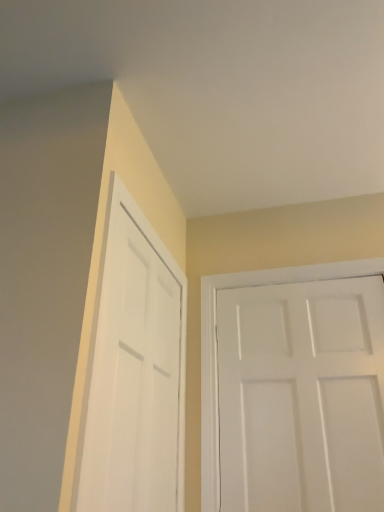
Question: Is point (145, 247) positioned closer to the camera than point (304, 358)?

Choices:
 (A) farther
 (B) closer

Answer: (B)

Question: Considering the positions of white matte door at left, marked as the 1th door in a left-to-right arrangement, and white matte door at right, which is counted as the 2th door, starting from the left, in the image, is white matte door at left, marked as the 1th door in a left-to-right arrangement, taller or shorter than white matte door at right, which is counted as the 2th door, starting from the left,?

Choices:
 (A) short
 (B) tall

Answer: (B)

Question: Considering the positions of white matte door at left, marked as the 1th door in a left-to-right arrangement, and white matte door at right, which is counted as the 2th door, starting from the left, in the image, is white matte door at left, marked as the 1th door in a left-to-right arrangement, wider or thinner than white matte door at right, which is counted as the 2th door, starting from the left,?

Choices:
 (A) wide
 (B) thin

Answer: (B)

Question: Relative to white matte door at left, marked as the 1th door in a left-to-right arrangement, is white matte door at right, which is counted as the 2th door, starting from the left, in front or behind?

Choices:
 (A) front
 (B) behind

Answer: (B)

Question: Visually, is white matte door at right, which is counted as the 2th door, starting from the left, positioned to the left or to the right of white matte door at left, marked as the 1th door in a left-to-right arrangement?

Choices:
 (A) left
 (B) right

Answer: (B)

Question: Considering the positions of white matte door at right, which is counted as the 2th door, starting from the left, and white matte door at left, acting as the 2th door starting from the right, in the image, is white matte door at right, which is counted as the 2th door, starting from the left, wider or thinner than white matte door at left, acting as the 2th door starting from the right,?

Choices:
 (A) thin
 (B) wide

Answer: (B)

Question: Do you think white matte door at right, which is counted as the 2th door, starting from the left, is within white matte door at left, marked as the 1th door in a left-to-right arrangement, or outside of it?

Choices:
 (A) outside
 (B) inside

Answer: (A)